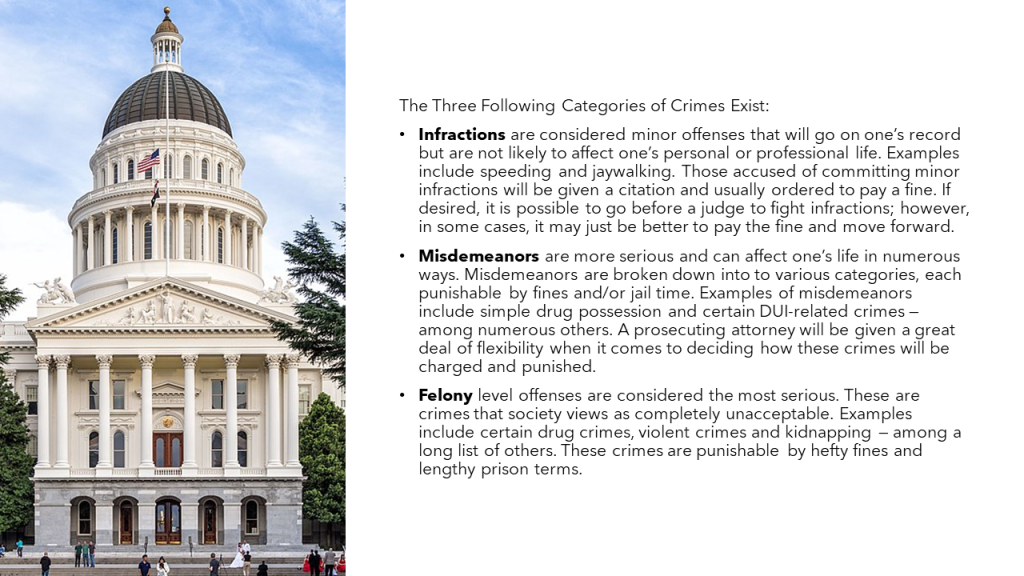
The image size is (1024, 576). I want to click on entry, so click(164, 541), click(170, 522).